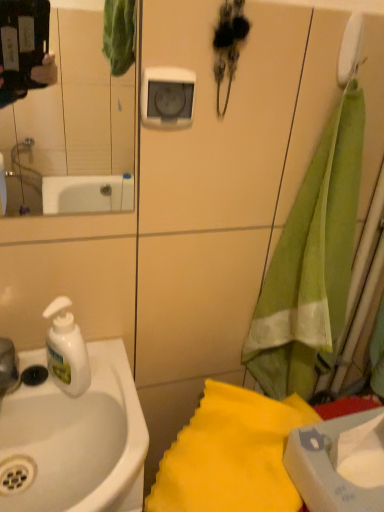
The image size is (384, 512). I want to click on white matte soap dispenser at left, so click(x=66, y=349).

This screenshot has height=512, width=384. Find the location of `white glossy sink at left`. white glossy sink at left is located at coordinates (78, 440).

Measure the distance between point (x=321, y=163) and camera.

Point (x=321, y=163) and camera are 28.31 inches apart from each other.

What is the approximate height of clear glass mirror at upper left?

It is 12.17 inches.

Find the location of a particular element. Image resolution: width=384 pixels, height=512 pixels. clear glass mirror at upper left is located at coordinates pos(70,115).

Find the location of a particular element. white matte soap dispenser at left is located at coordinates [66, 349].

At what (x,y) coordinates should I click in order to perform the action: click on soap dispenser directly beneath the clear glass mirror at upper left (from a real-world perspective). Please return your answer as a coordinate pair (x, y). The height and width of the screenshot is (512, 384). Looking at the image, I should click on (66, 349).

Is the position of white matte soap dispenser at left more distant than that of clear glass mirror at upper left?

Yes.

Is white matte soap dispenser at left located outside clear glass mirror at upper left?

Yes, white matte soap dispenser at left is located beyond the bounds of clear glass mirror at upper left.

From a real-world perspective, which is physically below, clear glass mirror at upper left or white glossy sink at left?

From a 3D spatial view, white glossy sink at left is below.

Is clear glass mirror at upper left aimed at white glossy sink at left?

No.

Is clear glass mirror at upper left not close to white glossy sink at left?

Yes, clear glass mirror at upper left and white glossy sink at left are located far from each other.

How different are the orientations of clear glass mirror at upper left and white glossy sink at left in degrees?

They differ by 2.03 degrees in their facing directions.

Considering the relative sizes of white plastic faucet at left and yellow fabric towel at lower right, the 1th beach towel in the bottom-to-top sequence, in the image provided, is white plastic faucet at left taller than yellow fabric towel at lower right, the 1th beach towel in the bottom-to-top sequence,?

No, white plastic faucet at left is not taller than yellow fabric towel at lower right, the 1th beach towel in the bottom-to-top sequence.

Where is `the 1st beach towel counting from the right of the white plastic faucet at left`? The image size is (384, 512). the 1st beach towel counting from the right of the white plastic faucet at left is located at coordinates (231, 455).

Considering the sizes of objects white plastic faucet at left and yellow fabric towel at lower right, the 2th beach towel in the top-to-bottom sequence, in the image provided, who is smaller, white plastic faucet at left or yellow fabric towel at lower right, the 2th beach towel in the top-to-bottom sequence,?

white plastic faucet at left.

The image size is (384, 512). Identify the location of the 1st beach towel to the right of the white matte soap dispenser at left, counting from the anchor's position. (231, 455).

Is yellow fabric towel at lower right, the 2th beach towel in the top-to-bottom sequence, surrounding white matte soap dispenser at left?

That's incorrect, white matte soap dispenser at left is not inside yellow fabric towel at lower right, the 2th beach towel in the top-to-bottom sequence.

Can you confirm if yellow fabric towel at lower right, the 2th beach towel in the top-to-bottom sequence, is smaller than white matte soap dispenser at left?

Incorrect, yellow fabric towel at lower right, the 2th beach towel in the top-to-bottom sequence, is not smaller in size than white matte soap dispenser at left.

Between white glossy sink at left and white matte soap dispenser at left, which one has smaller size?

white matte soap dispenser at left.

Is white glossy sink at left wider than white matte soap dispenser at left?

Correct, the width of white glossy sink at left exceeds that of white matte soap dispenser at left.

The width and height of the screenshot is (384, 512). What are the coordinates of `sink located in front of the white matte soap dispenser at left` in the screenshot? It's located at (78, 440).

From the image's perspective, which object appears higher, white glossy sink at left or white matte soap dispenser at left?

white matte soap dispenser at left, from the image's perspective.

Is yellow fabric towel at lower right, the 2th beach towel in the top-to-bottom sequence, completely or partially inside white matte soap dispenser at left?

That's incorrect, yellow fabric towel at lower right, the 2th beach towel in the top-to-bottom sequence, is not inside white matte soap dispenser at left.

Considering their positions, is white matte soap dispenser at left located in front of or behind yellow fabric towel at lower right, the 2th beach towel in the top-to-bottom sequence?

Clearly, white matte soap dispenser at left is behind yellow fabric towel at lower right, the 2th beach towel in the top-to-bottom sequence.

Which object is wider, white matte soap dispenser at left or yellow fabric towel at lower right, the 1th beach towel in the bottom-to-top sequence?

Wider between the two is yellow fabric towel at lower right, the 1th beach towel in the bottom-to-top sequence.

Find the location of a particular element. soap dispenser above the yellow fabric towel at lower right, the 2th beach towel in the top-to-bottom sequence (from a real-world perspective) is located at coordinates (66, 349).

From the image's perspective, between yellow fabric towel at lower right, the 2th beach towel in the top-to-bottom sequence, and white plastic faucet at left, which one is located above?

white plastic faucet at left, from the image's perspective.

Is yellow fabric towel at lower right, the 2th beach towel in the top-to-bottom sequence, bigger or smaller than white plastic faucet at left?

yellow fabric towel at lower right, the 2th beach towel in the top-to-bottom sequence, is bigger than white plastic faucet at left.

Considering the relative positions of yellow fabric towel at lower right, the 1th beach towel in the bottom-to-top sequence, and white plastic faucet at left in the image provided, is yellow fabric towel at lower right, the 1th beach towel in the bottom-to-top sequence, to the right of white plastic faucet at left from the viewer's perspective?

Indeed, yellow fabric towel at lower right, the 1th beach towel in the bottom-to-top sequence, is positioned on the right side of white plastic faucet at left.

Is yellow fabric towel at lower right, the 2th beach towel in the top-to-bottom sequence, not near white plastic faucet at left?

yellow fabric towel at lower right, the 2th beach towel in the top-to-bottom sequence, is actually quite close to white plastic faucet at left.

This screenshot has width=384, height=512. In order to click on soap dispenser on the right of the clear glass mirror at upper left in this screenshot , I will do pyautogui.click(x=66, y=349).

The image size is (384, 512). Find the location of `mirror above the white glossy sink at left (from the image's perspective)`. mirror above the white glossy sink at left (from the image's perspective) is located at coordinates [x=70, y=115].

Looking at the image, which one is located further to green fabric towel at right, the second beach towel from the bottom, white glossy sink at left or white matte soap dispenser at left?

white matte soap dispenser at left is positioned further to the anchor green fabric towel at right, the second beach towel from the bottom.

Considering their positions, is white plastic faucet at left positioned closer to clear glass mirror at upper left than white glossy sink at left?

The object closer to clear glass mirror at upper left is white glossy sink at left.

Estimate the real-world distances between objects in this image. Which object is closer to yellow fabric towel at lower right, the 2th beach towel in the top-to-bottom sequence, white matte soap dispenser at left or green fabric towel at right, the second beach towel from the bottom?

green fabric towel at right, the second beach towel from the bottom.

Looking at the image, which one is located further to yellow fabric towel at lower right, the 1th beach towel in the bottom-to-top sequence, green fabric towel at right, the second beach towel from the bottom, or clear glass mirror at upper left?

Among the two, clear glass mirror at upper left is located further to yellow fabric towel at lower right, the 1th beach towel in the bottom-to-top sequence.

Looking at the image, which one is located closer to white matte soap dispenser at left, white plastic faucet at left or white glossy sink at left?

The object closer to white matte soap dispenser at left is white plastic faucet at left.

Looking at the image, which one is located closer to white glossy sink at left, white plastic faucet at left or white matte soap dispenser at left?

white matte soap dispenser at left is closer to white glossy sink at left.

When comparing their distances from clear glass mirror at upper left, does white matte soap dispenser at left or white glossy sink at left seem closer?

white glossy sink at left.

Based on their spatial positions, is white plastic faucet at left or white glossy sink at left further from green fabric towel at right, the second beach towel from the bottom?

Among the two, white plastic faucet at left is located further to green fabric towel at right, the second beach towel from the bottom.

Find the location of a particular element. Image resolution: width=384 pixels, height=512 pixels. sink that lies between clear glass mirror at upper left and yellow fabric towel at lower right, the 1th beach towel in the bottom-to-top sequence, from top to bottom is located at coordinates (78, 440).

Find the location of a particular element. This screenshot has height=512, width=384. beach towel between white glossy sink at left and green fabric towel at right, the second beach towel from the bottom is located at coordinates (231, 455).

The image size is (384, 512). Identify the location of beach towel located between clear glass mirror at upper left and green fabric towel at right, the first beach towel positioned from the top, in the left-right direction. (231, 455).

I want to click on soap dispenser situated between white plastic faucet at left and green fabric towel at right, the first beach towel positioned from the top, from left to right, so click(66, 349).